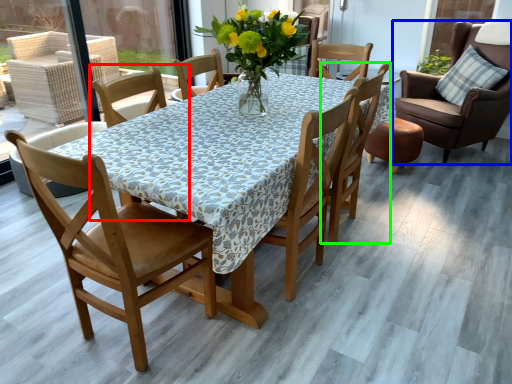
Question: Which is nearer to the chair (highlighted by a red box)? chair (highlighted by a blue box) or chair (highlighted by a green box).

Choices:
 (A) chair
 (B) chair

Answer: (B)